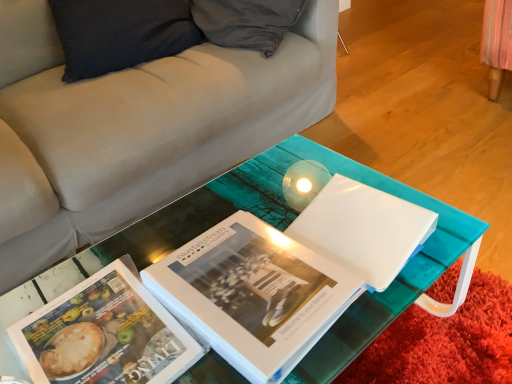
Describe the element at coordinates (362, 229) in the screenshot. I see `white glossy folder at center` at that location.

Where is `transparent glass table at center`? Image resolution: width=512 pixels, height=384 pixels. transparent glass table at center is located at coordinates (283, 230).

This screenshot has height=384, width=512. What do you see at coordinates (253, 295) in the screenshot? I see `white glossy book at center, arranged as the 2th book when viewed from the left` at bounding box center [253, 295].

This screenshot has height=384, width=512. What are the coordinates of `white glossy folder at center` in the screenshot? It's located at (362, 229).

Would you say white glossy folder at center is outside transparent glass table at center?

Yes.

From the image's perspective, which is below, white glossy folder at center or transparent glass table at center?

From the image's view, white glossy folder at center is below.

Is white glossy folder at center facing towards transparent glass table at center?

No, white glossy folder at center is not aimed at transparent glass table at center.

Is matte paper book at center, which is the 1th book from left to right, thinner than transparent glass table at center?

Correct, the width of matte paper book at center, which is the 1th book from left to right, is less than that of transparent glass table at center.

From a real-world perspective, is matte paper book at center, which is counted as the 2th book, starting from the right, physically located above or below transparent glass table at center?

matte paper book at center, which is counted as the 2th book, starting from the right, is situated higher than transparent glass table at center in the real world.

From the image's perspective, is matte paper book at center, which is the 1th book from left to right, above or below transparent glass table at center?

Based on their image positions, matte paper book at center, which is the 1th book from left to right, is located beneath transparent glass table at center.

From the picture: Is matte paper book at center, which is counted as the 2th book, starting from the right, spatially inside white glossy book at center, arranged as the 2th book when viewed from the left, or outside of it?

matte paper book at center, which is counted as the 2th book, starting from the right, lies outside white glossy book at center, arranged as the 2th book when viewed from the left.

The height and width of the screenshot is (384, 512). In order to click on book above the matte paper book at center, which is the 1th book from left to right (from the image's perspective) in this screenshot , I will do `click(253, 295)`.

Which is behind, point (87, 295) or point (221, 279)?

Positioned behind is point (87, 295).

Is there a large distance between matte paper book at center, which is the 1th book from left to right, and white glossy book at center, arranged as the 2th book when viewed from the left?

No, matte paper book at center, which is the 1th book from left to right, is in close proximity to white glossy book at center, arranged as the 2th book when viewed from the left.

Based on the photo, could you tell me if transparent glass table at center is facing white glossy folder at center?

No.

Considering the positions of objects transparent glass table at center and white glossy folder at center in the image provided, who is more to the left, transparent glass table at center or white glossy folder at center?

white glossy folder at center.

How different are the orientations of transparent glass table at center and white glossy folder at center in degrees?

The facing directions of transparent glass table at center and white glossy folder at center are 96.5 degrees apart.

From a real-world perspective, is transparent glass table at center above or below white glossy folder at center?

Clearly, from a real-world perspective, transparent glass table at center is below white glossy folder at center.

Can matte paper book at center, which is counted as the 2th book, starting from the right, be found inside transparent glass table at center?

No, matte paper book at center, which is counted as the 2th book, starting from the right, is not surrounded by transparent glass table at center.

How far apart are transparent glass table at center and matte paper book at center, which is counted as the 2th book, starting from the right?

transparent glass table at center and matte paper book at center, which is counted as the 2th book, starting from the right, are 7.28 inches apart.

Who is shorter, transparent glass table at center or matte paper book at center, which is the 1th book from left to right?

With less height is matte paper book at center, which is the 1th book from left to right.

This screenshot has width=512, height=384. I want to click on book that is the 2nd object located behind the transparent glass table at center, so click(104, 334).

Is white glossy book at center, arranged as the 1th book when viewed from the right, in front of matte paper book at center, which is counted as the 2th book, starting from the right?

Yes, the depth of white glossy book at center, arranged as the 1th book when viewed from the right, is less than that of matte paper book at center, which is counted as the 2th book, starting from the right.

Is white glossy book at center, arranged as the 1th book when viewed from the right, directly adjacent to matte paper book at center, which is the 1th book from left to right?

No, white glossy book at center, arranged as the 1th book when viewed from the right, is not beside matte paper book at center, which is the 1th book from left to right.

Is white glossy book at center, arranged as the 1th book when viewed from the right, to the left or to the right of matte paper book at center, which is counted as the 2th book, starting from the right, in the image?

In the image, white glossy book at center, arranged as the 1th book when viewed from the right, appears on the right side of matte paper book at center, which is counted as the 2th book, starting from the right.

Is white glossy book at center, arranged as the 1th book when viewed from the right, behind white glossy folder at center?

No, the depth of white glossy book at center, arranged as the 1th book when viewed from the right, is less than that of white glossy folder at center.

Considering the relative sizes of white glossy book at center, arranged as the 1th book when viewed from the right, and white glossy folder at center in the image provided, is white glossy book at center, arranged as the 1th book when viewed from the right, bigger than white glossy folder at center?

Yes.

Is white glossy book at center, arranged as the 2th book when viewed from the left, looking in the opposite direction of white glossy folder at center?

white glossy book at center, arranged as the 2th book when viewed from the left, does not have its back to white glossy folder at center.

Which of these two, white glossy book at center, arranged as the 2th book when viewed from the left, or white glossy folder at center, is wider?

With larger width is white glossy book at center, arranged as the 2th book when viewed from the left.

This screenshot has height=384, width=512. What are the coordinates of `table above the white glossy folder at center (from the image's perspective)` in the screenshot? It's located at (283, 230).

From a real-world perspective, starting from the transparent glass table at center, which book is the 1st one vertically above it? Please provide its 2D coordinates.

[(104, 334)]

Estimate the real-world distances between objects in this image. Which object is closer to transparent glass table at center, matte paper book at center, which is the 1th book from left to right, or white glossy book at center, arranged as the 1th book when viewed from the right?

Based on the image, white glossy book at center, arranged as the 1th book when viewed from the right, appears to be nearer to transparent glass table at center.

Based on their spatial positions, is white glossy folder at center or transparent glass table at center closer to matte paper book at center, which is counted as the 2th book, starting from the right?

transparent glass table at center lies closer to matte paper book at center, which is counted as the 2th book, starting from the right, than the other object.

Based on their spatial positions, is white glossy book at center, arranged as the 2th book when viewed from the left, or white glossy folder at center further from matte paper book at center, which is the 1th book from left to right?

Among the two, white glossy folder at center is located further to matte paper book at center, which is the 1th book from left to right.

When comparing their distances from transparent glass table at center, does matte paper book at center, which is the 1th book from left to right, or white glossy folder at center seem further?

matte paper book at center, which is the 1th book from left to right, is positioned further to the anchor transparent glass table at center.

Consider the image. When comparing their distances from matte paper book at center, which is the 1th book from left to right, does white glossy folder at center or white glossy book at center, arranged as the 1th book when viewed from the right, seem further?

Among the two, white glossy folder at center is located further to matte paper book at center, which is the 1th book from left to right.

Which object lies further to the anchor point white glossy book at center, arranged as the 1th book when viewed from the right, transparent glass table at center or matte paper book at center, which is the 1th book from left to right?

matte paper book at center, which is the 1th book from left to right, is further to white glossy book at center, arranged as the 1th book when viewed from the right.

Which object lies nearer to the anchor point white glossy folder at center, white glossy book at center, arranged as the 2th book when viewed from the left, or transparent glass table at center?

transparent glass table at center is positioned closer to the anchor white glossy folder at center.

When comparing their distances from transparent glass table at center, does white glossy folder at center or matte paper book at center, which is the 1th book from left to right, seem closer?

white glossy folder at center is positioned closer to the anchor transparent glass table at center.

You are a GUI agent. You are given a task and a screenshot of the screen. Output one action in this format:
    pyautogui.click(x=<x>, y=<y>)
    Task: Click on the paperback book between transparent glass table at center and white glossy book at center, arranged as the 1th book when viewed from the right, from top to bottom
    The image size is (512, 384).
    Given the screenshot: What is the action you would take?
    pyautogui.click(x=362, y=229)

The height and width of the screenshot is (384, 512). In order to click on book located between matte paper book at center, which is the 1th book from left to right, and white glossy folder at center in the left-right direction in this screenshot , I will do `click(253, 295)`.

Locate an element on the screen. The width and height of the screenshot is (512, 384). paperback book between matte paper book at center, which is counted as the 2th book, starting from the right, and transparent glass table at center is located at coordinates (362, 229).

At what (x,y) coordinates should I click in order to perform the action: click on book between transparent glass table at center and matte paper book at center, which is the 1th book from left to right, from top to bottom. Please return your answer as a coordinate pair (x, y). Looking at the image, I should click on click(x=253, y=295).